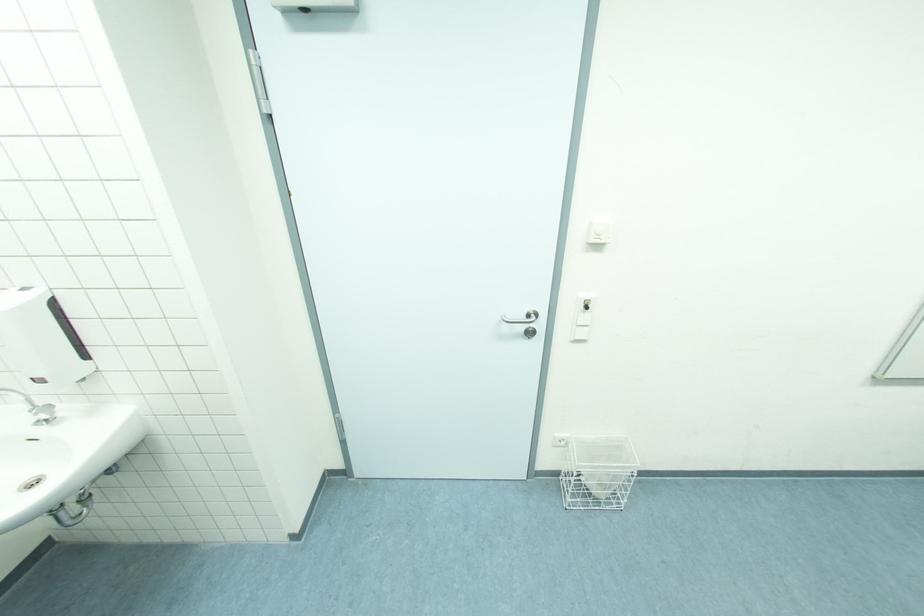
Describe the element at coordinates (524, 320) in the screenshot. I see `the silver door handle` at that location.